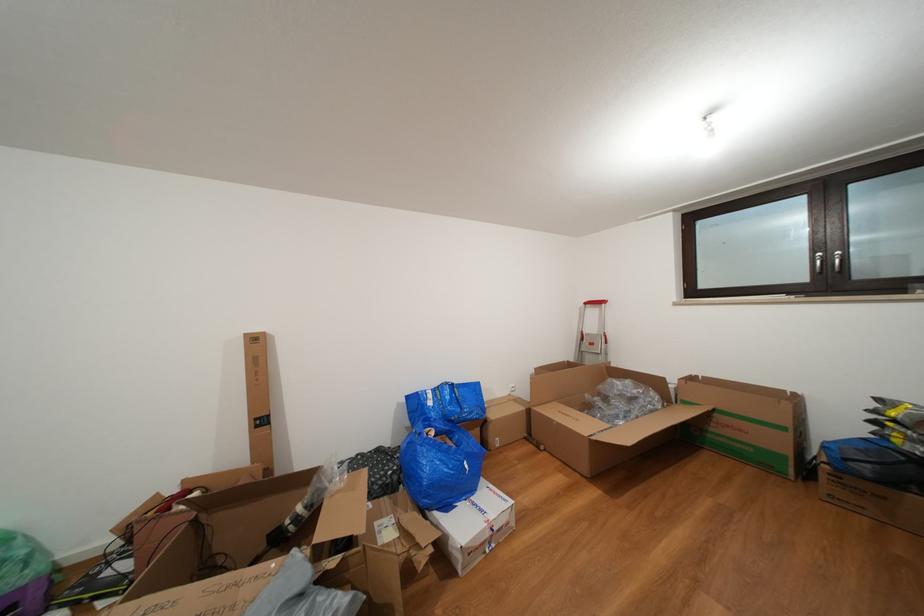
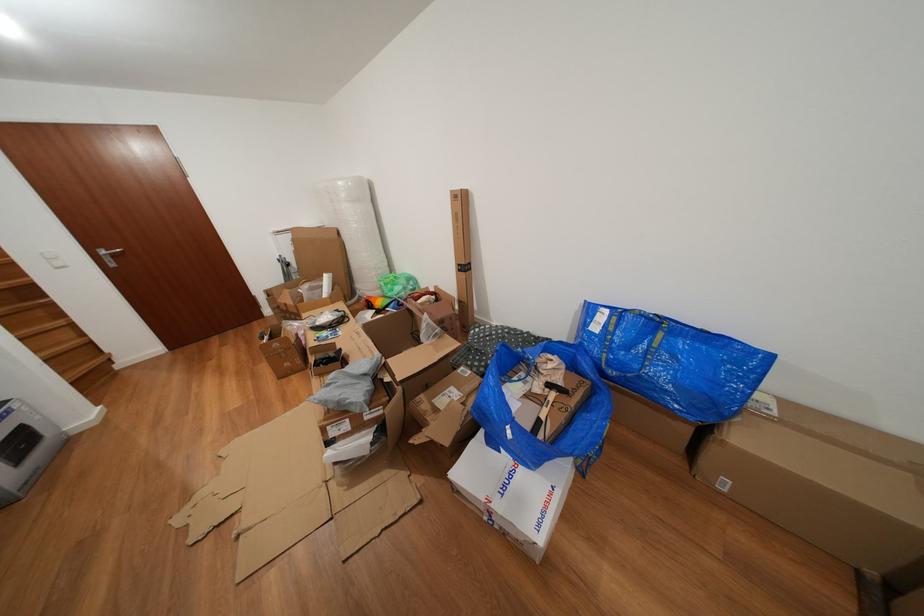
Where in the second image is the point corresponding to the point at 492,418 from the first image?

(734, 424)